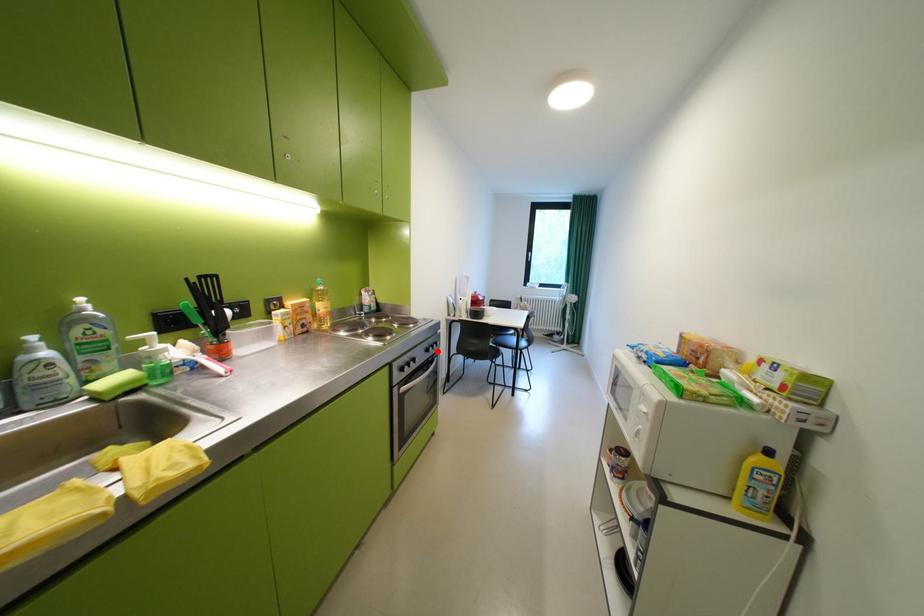
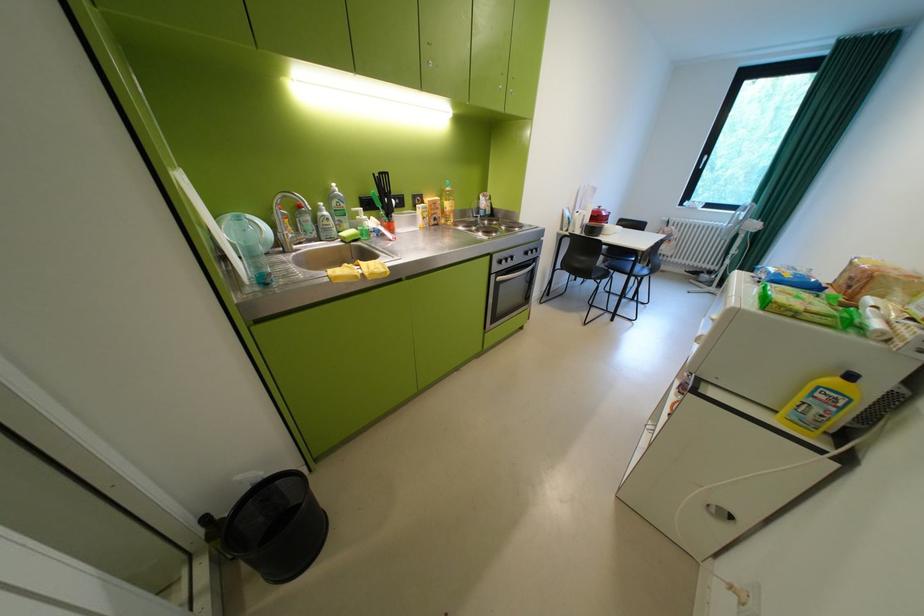
The point at the highlighted location is marked in the first image. Where is the corresponding point in the second image?

(537, 254)